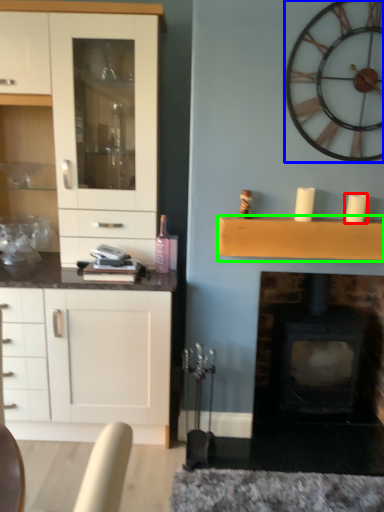
Question: Considering the real-world distances, which object is farthest from candle (highlighted by a red box)? wall clock (highlighted by a blue box) or shelf (highlighted by a green box)?

Choices:
 (A) wall clock
 (B) shelf

Answer: (A)